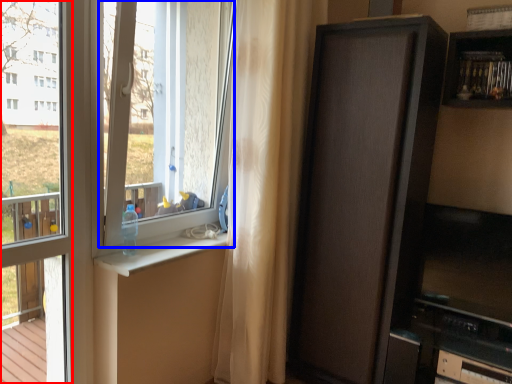
Question: Which object appears farthest to the camera in this image, window frame (highlighted by a red box) or window screen (highlighted by a blue box)?

Choices:
 (A) window frame
 (B) window screen

Answer: (B)